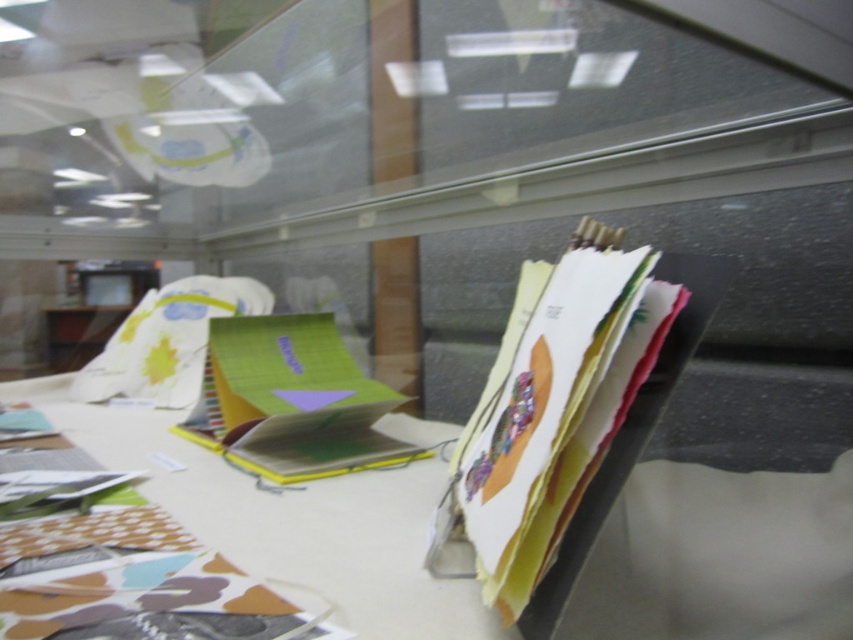
Question: Does matte paper table at center appear on the left side of matte paper stack at right?

Choices:
 (A) yes
 (B) no

Answer: (A)

Question: Which of the following is the farthest from the observer?

Choices:
 (A) matte paper table at center
 (B) matte paper stack at right

Answer: (A)

Question: Which point is farther from the camera taking this photo?

Choices:
 (A) (410, 637)
 (B) (476, 480)

Answer: (B)

Question: Is matte paper table at center to the right of matte paper stack at right from the viewer's perspective?

Choices:
 (A) yes
 (B) no

Answer: (B)

Question: Does matte paper table at center lie behind matte paper stack at right?

Choices:
 (A) no
 (B) yes

Answer: (B)

Question: Which point is farther to the camera?

Choices:
 (A) (646, 280)
 (B) (332, 564)

Answer: (B)